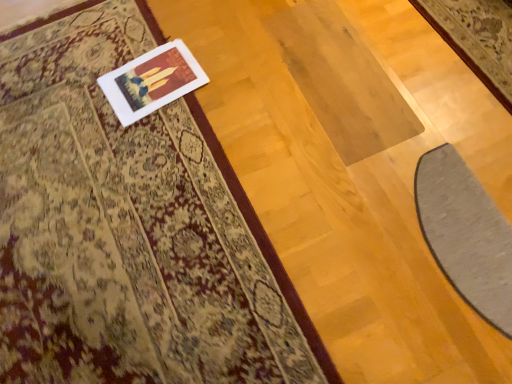
The image size is (512, 384). Find the location of `vacant space underneath gray soft mat at lower right (from a real-world perspective)`. vacant space underneath gray soft mat at lower right (from a real-world perspective) is located at coordinates coord(467,235).